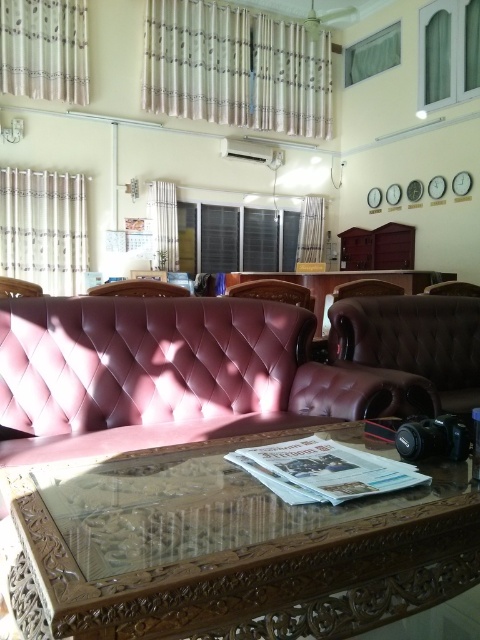
Question: Does transparent glass table at center have a smaller size compared to leather couch at left?

Choices:
 (A) yes
 (B) no

Answer: (B)

Question: Which of the following is the farthest from the observer?

Choices:
 (A) white sheer curtain at center
 (B) sheer fabric curtain at upper center
 (C) brown leather chair at right
 (D) leather couch at left

Answer: (A)

Question: Is transparent glass table at center smaller than sheer fabric curtain at upper center?

Choices:
 (A) no
 (B) yes

Answer: (B)

Question: Which point is closer to the camera?

Choices:
 (A) pyautogui.click(x=435, y=284)
 (B) pyautogui.click(x=8, y=292)

Answer: (B)

Question: Where is leather-like brown armchair at center located in relation to white sheer curtain at left in the image?

Choices:
 (A) left
 (B) right

Answer: (B)

Question: Which of the following is the closest to the observer?

Choices:
 (A) leather-like brown armchair at center
 (B) white sheer curtain at left

Answer: (A)